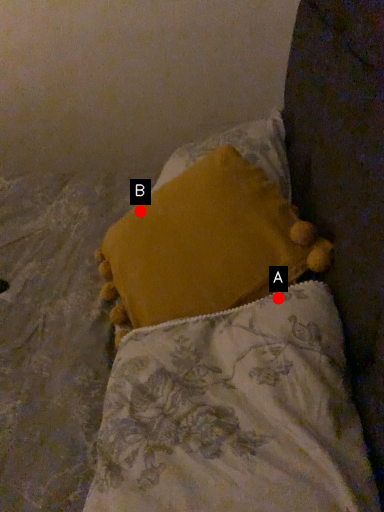
Question: Two points are circled on the image, labeled by A and B beside each circle. Which point is closer to the camera taking this photo?

Choices:
 (A) A is closer
 (B) B is closer

Answer: (A)